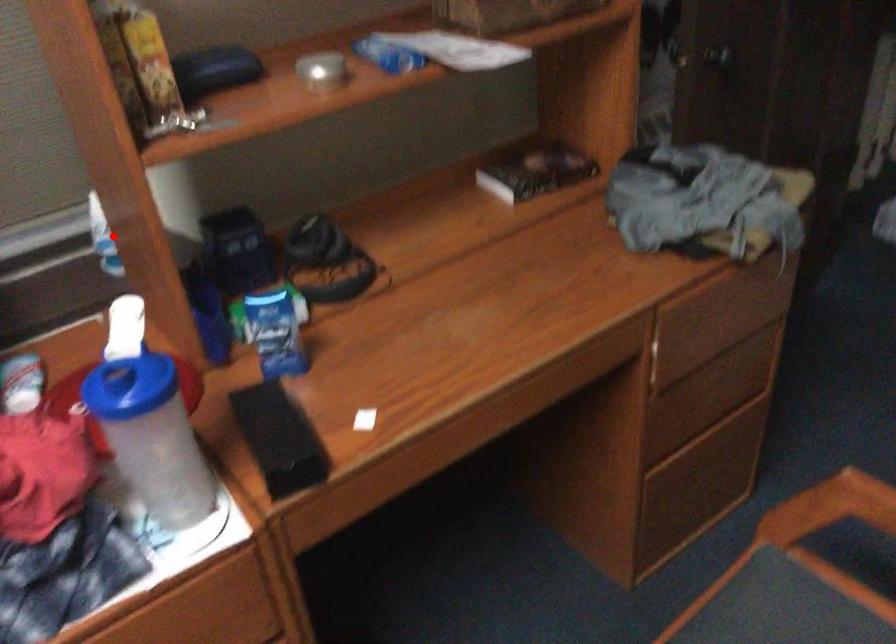
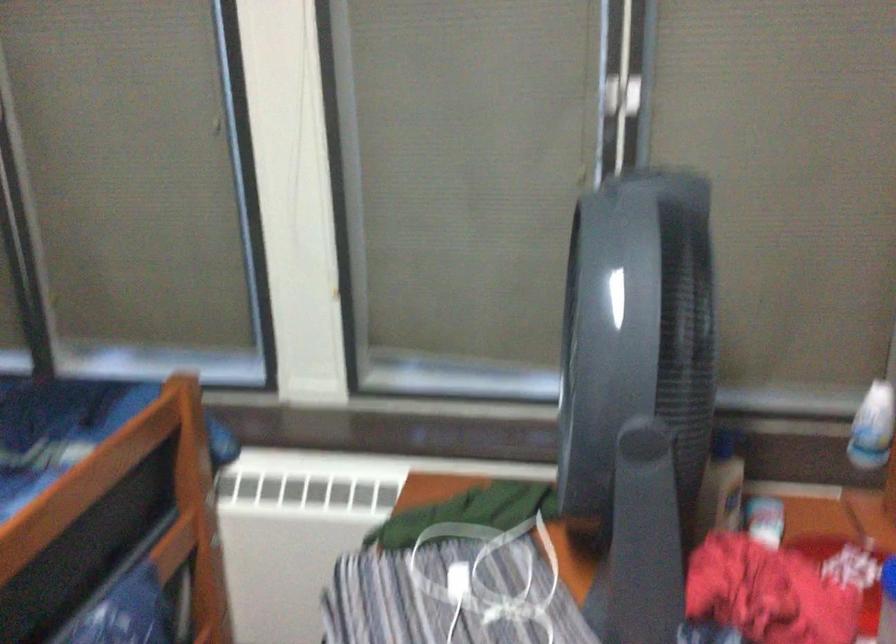
Question: A red point is marked in image1. In image2, is the corresponding 3D point closer to the camera or farther? Reply with the corresponding letter.

Choices:
 (A) The corresponding 3D point is closer.
 (B) The corresponding 3D point is farther.

Answer: (B)